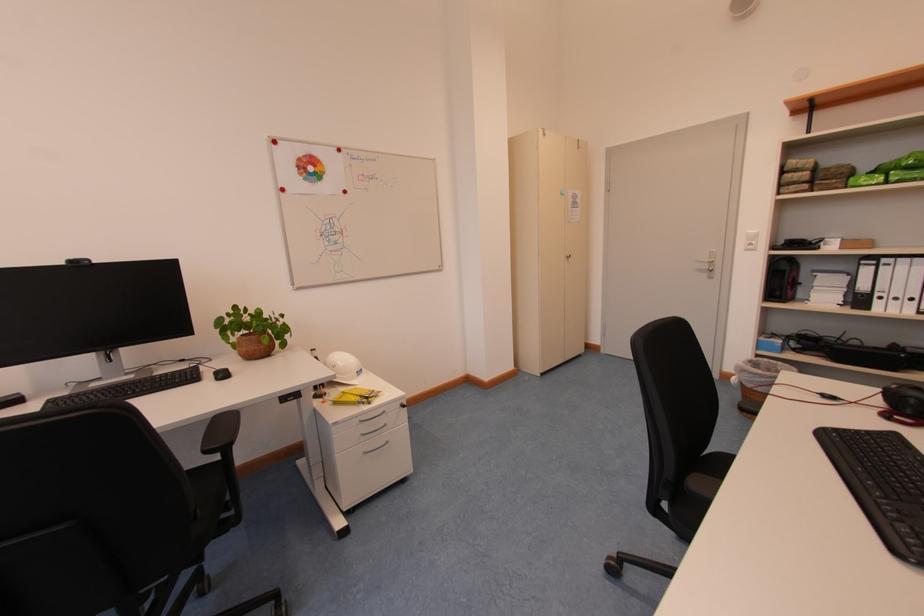
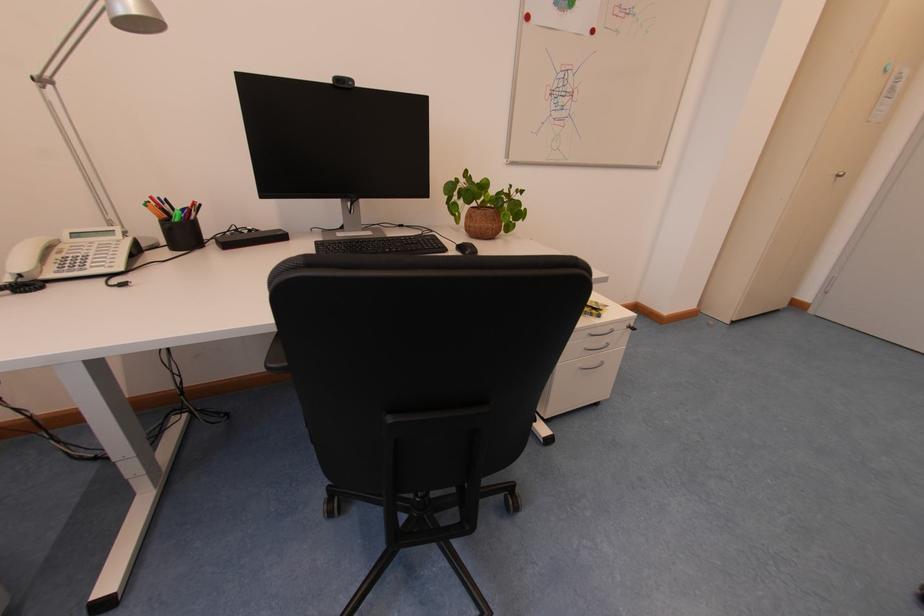
Question: The images are taken continuously from a first-person perspective. In which direction is your viewpoint rotating?

Choices:
 (A) Left
 (B) Right
 (C) Up
 (D) Down

Answer: (D)